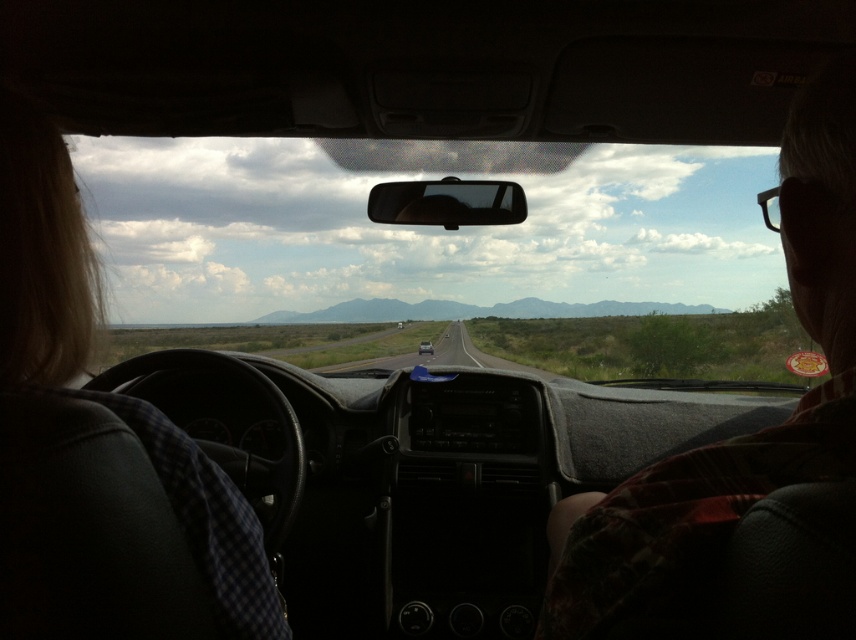
Does plaid shirt at right appear over asphalt road at center?

Yes.

This screenshot has height=640, width=856. What are the coordinates of `plaid shirt at right` in the screenshot? It's located at (733, 436).

Describe the element at coordinates (733, 436) in the screenshot. I see `plaid shirt at right` at that location.

Identify the location of plaid shirt at right. (733, 436).

Who is more forward, (399, 179) or (453, 339)?

Point (399, 179) is more forward.

Does transparent glass windshield at center appear on the right side of asphalt road at center?

Indeed, transparent glass windshield at center is positioned on the right side of asphalt road at center.

I want to click on transparent glass windshield at center, so click(444, 260).

Between blonde hair at left and metallic silver sedan at center, which one has less height?

metallic silver sedan at center

Is point (275, 628) closer to camera compared to point (428, 349)?

Yes, point (275, 628) is closer to viewer.

Identify the location of blonde hair at left. (88, 356).